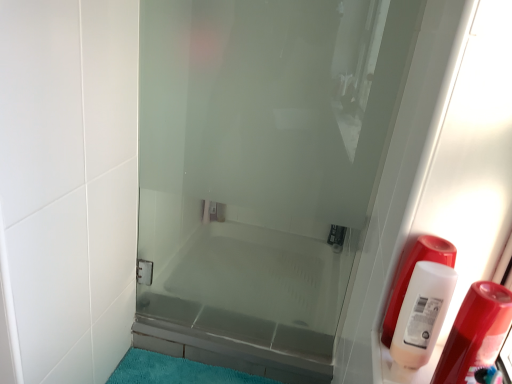
Question: Is teal plush bath mat at lower center in front of or behind transparent glass door at center in the image?

Choices:
 (A) front
 (B) behind

Answer: (B)

Question: From the image's perspective, is teal plush bath mat at lower center positioned above or below transparent glass door at center?

Choices:
 (A) below
 (B) above

Answer: (A)

Question: Which of these objects is positioned closest to the white plastic bottle at right?

Choices:
 (A) white plastic bottle at right
 (B) transparent glass door at center
 (C) teal plush bath mat at lower center

Answer: (A)

Question: Considering the real-world distances, which object is farthest from the transparent glass door at center?

Choices:
 (A) white plastic bottle at right
 (B) teal plush bath mat at lower center
 (C) white plastic bottle at right

Answer: (A)